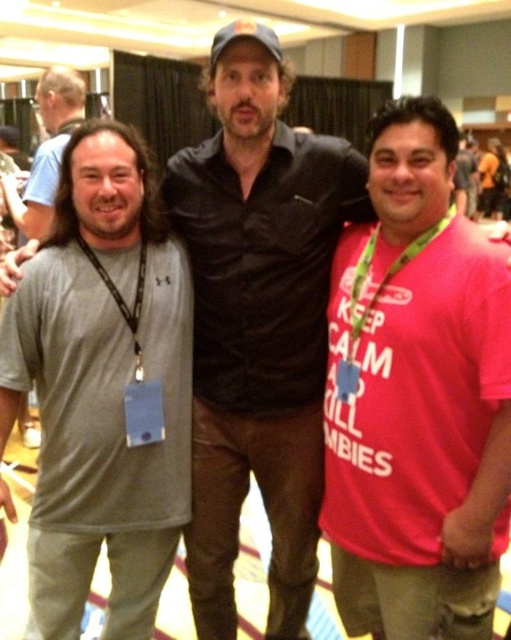
Question: Based on their relative distances, which object is nearer to the pink cotton t-shirt at right?

Choices:
 (A) gray fabric shirt at left
 (B) green fabric lanyard at center
 (C) gray cotton t-shirt at upper left

Answer: (B)

Question: Based on their relative distances, which object is farther from the pink cotton t-shirt at right?

Choices:
 (A) green fabric lanyard at center
 (B) gray fabric shirt at left
 (C) gray cotton t-shirt at upper left

Answer: (C)

Question: Which point appears closest to the camera in this image?

Choices:
 (A) (460, 372)
 (B) (110, 278)
 (C) (66, 92)

Answer: (A)

Question: From the image, what is the correct spatial relationship of pink cotton t-shirt at right in relation to gray fabric shirt at left?

Choices:
 (A) below
 (B) above

Answer: (B)

Question: Is pink cotton t-shirt at right in front of gray fabric shirt at left?

Choices:
 (A) yes
 (B) no

Answer: (A)

Question: Is pink cotton t-shirt at right below gray cotton t-shirt at upper left?

Choices:
 (A) yes
 (B) no

Answer: (A)